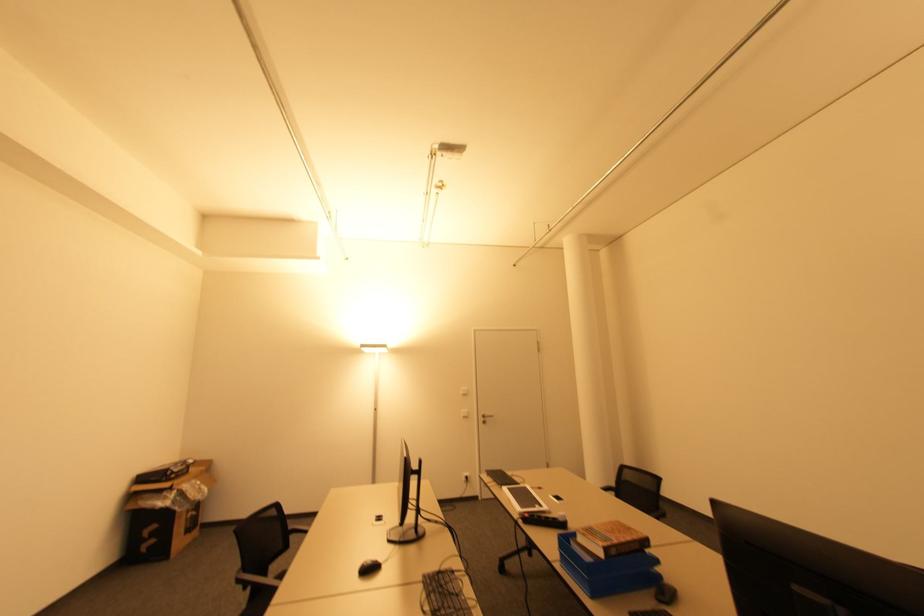
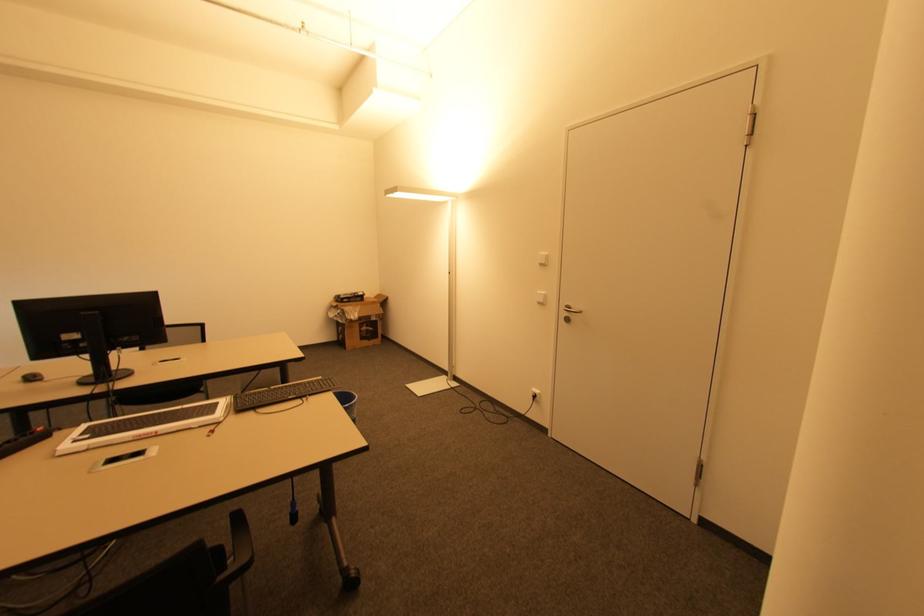
The point at (195, 516) is marked in the first image. Where is the corresponding point in the second image?

(369, 331)